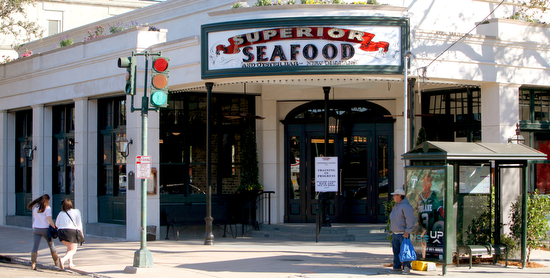
I want to click on restaurant, so click(x=291, y=96).